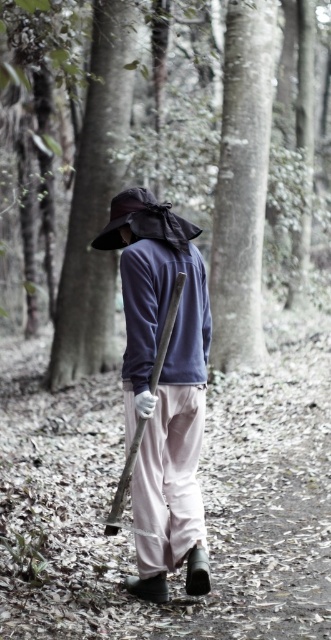
Is the position of brown textured tree trunk at center more distant than that of wooden shovel at center?

Yes.

Can you confirm if brown textured tree trunk at center is wider than wooden shovel at center?

Yes, brown textured tree trunk at center is wider than wooden shovel at center.

Between point (126, 54) and point (138, 420), which one is positioned in front?

Point (138, 420)

Locate an element on the screen. brown textured tree trunk at center is located at coordinates (94, 202).

Does matte black hat at center have a greater width compared to smooth bark tree at upper center?

Indeed, matte black hat at center has a greater width compared to smooth bark tree at upper center.

Is matte black hat at center thinner than smooth bark tree at upper center?

Incorrect, matte black hat at center's width is not less than smooth bark tree at upper center's.

Is point (280, 234) positioned in front of point (226, 360)?

No, (280, 234) is behind (226, 360).

Identify the location of matte black hat at center. The height and width of the screenshot is (640, 331). (192, 193).

The image size is (331, 640). Describe the element at coordinates (241, 182) in the screenshot. I see `smooth bark tree at upper center` at that location.

Measure the distance between point (229, 284) and camera.

Point (229, 284) is 31.10 feet from camera.

This screenshot has width=331, height=640. I want to click on smooth bark tree at upper center, so click(x=241, y=182).